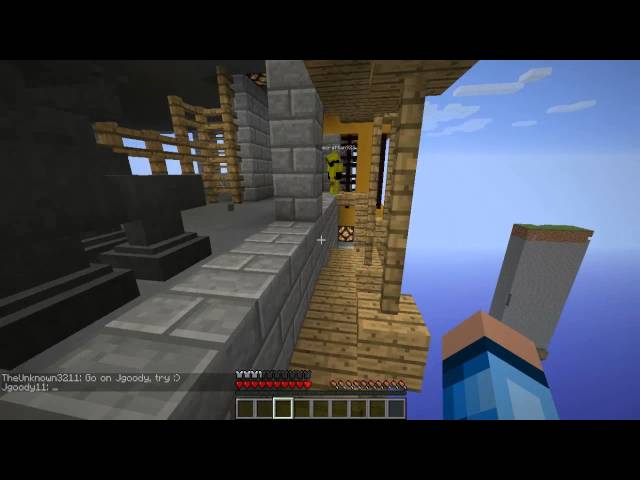
Locate an element on the screen. This screenshot has width=640, height=480. boxes is located at coordinates (244, 408).